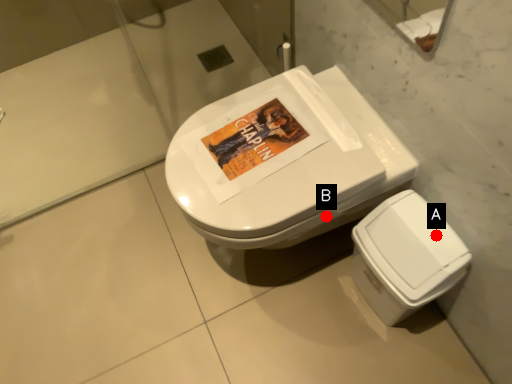
Question: Two points are circled on the image, labeled by A and B beside each circle. Which of the following is the farthest from the observer?

Choices:
 (A) A is further
 (B) B is further

Answer: (B)